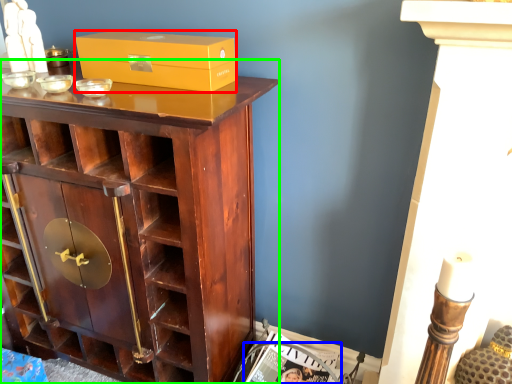
Question: Based on their relative distances, which object is nearer to box (highlighted by a red box)? Choose from magazine (highlighted by a blue box) and cupboard (highlighted by a green box).

Choices:
 (A) magazine
 (B) cupboard

Answer: (B)